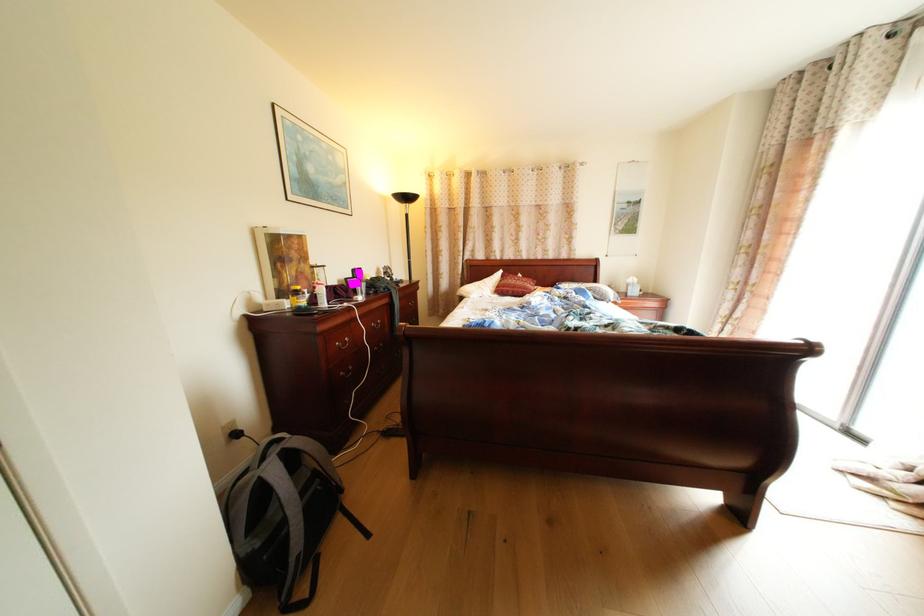
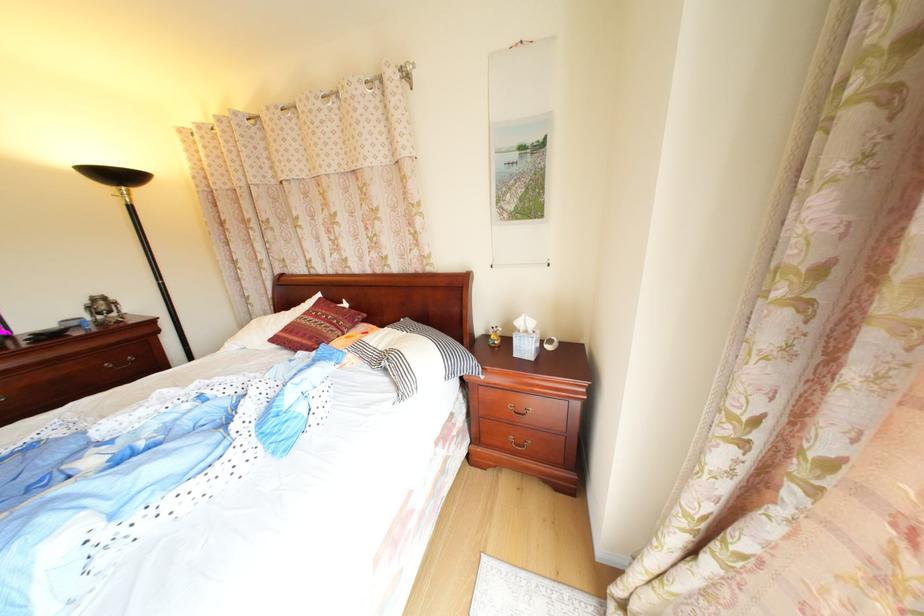
In the second image, find the point that corresponds to (x=403, y=270) in the first image.

(116, 301)